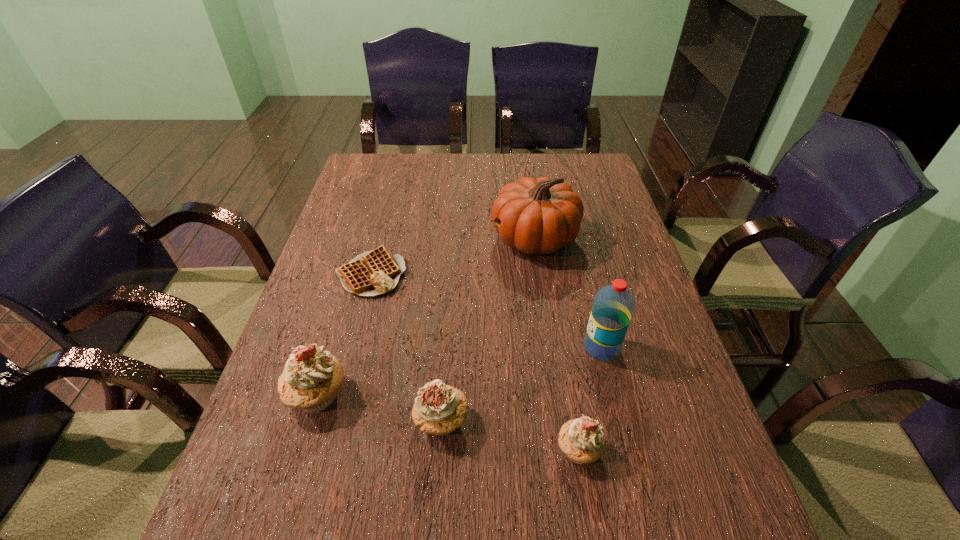
Image resolution: width=960 pixels, height=540 pixels. I want to click on object that stands as the third closest to the waffle, so click(439, 409).

You are a GUI agent. You are given a task and a screenshot of the screen. Output one action in this format:
    pyautogui.click(x=<x>, y=<y>)
    Task: Click on the third closest cupcake to the water bottle
    This screenshot has width=960, height=540.
    Given the screenshot: What is the action you would take?
    pyautogui.click(x=311, y=379)

Locate which cupcake is the second closest to the fourth nearest object. Please provide its 2D coordinates. Your answer should be formatted as a tuple, i.e. [(x, y)], where the tuple contains the x and y coordinates of a point satisfying the conditions above.

[(439, 409)]

At what (x,y) coordinates should I click in order to perform the action: click on vacant region that satisfies the following two spatial constraints: 1. on the face of the pumpkin; 2. on the left side of the rightmost cupcake. Please return your answer as a coordinate pair (x, y). Looking at the image, I should click on (564, 450).